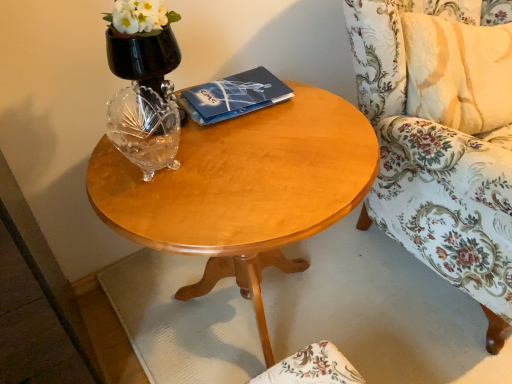
Where is `blank space situated above dark blue matte paper at center (from a real-world perspective)`? This screenshot has height=384, width=512. blank space situated above dark blue matte paper at center (from a real-world perspective) is located at coordinates (233, 87).